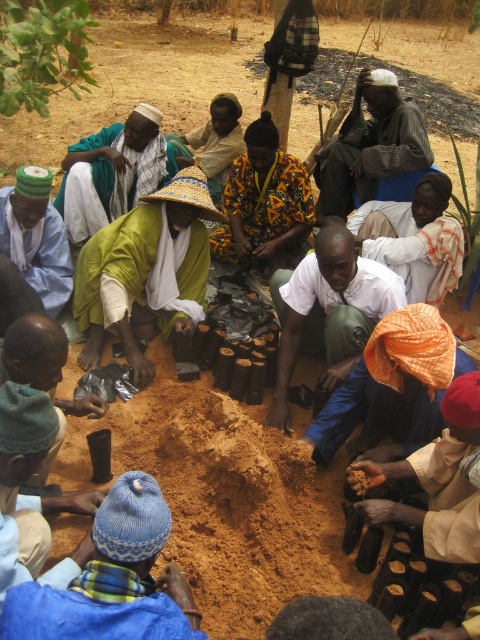
Question: Is blue knitted hat at lower left to the left of orange fabric at lower right from the viewer's perspective?

Choices:
 (A) yes
 (B) no

Answer: (A)

Question: Can you confirm if green leafy tree at upper left is bigger than green woven hat at center?

Choices:
 (A) no
 (B) yes

Answer: (A)

Question: Is white matte shirt at center below green woven hat at center?

Choices:
 (A) no
 (B) yes

Answer: (B)

Question: Estimate the real-world distances between objects in this image. Which object is farther from the white cotton shirt at center?

Choices:
 (A) white matte shirt at center
 (B) green fabric hat at lower left

Answer: (B)

Question: Which point is closer to the camera?

Choices:
 (A) orange fabric at lower right
 (B) green woven hat at center
 (C) knitted woolen cap at lower left
 (D) green leafy tree at upper left

Answer: (C)

Question: Among these objects, which one is nearest to the camera?

Choices:
 (A) green woven hat at center
 (B) green leafy tree at upper left
 (C) green felt hat at lower left

Answer: (B)